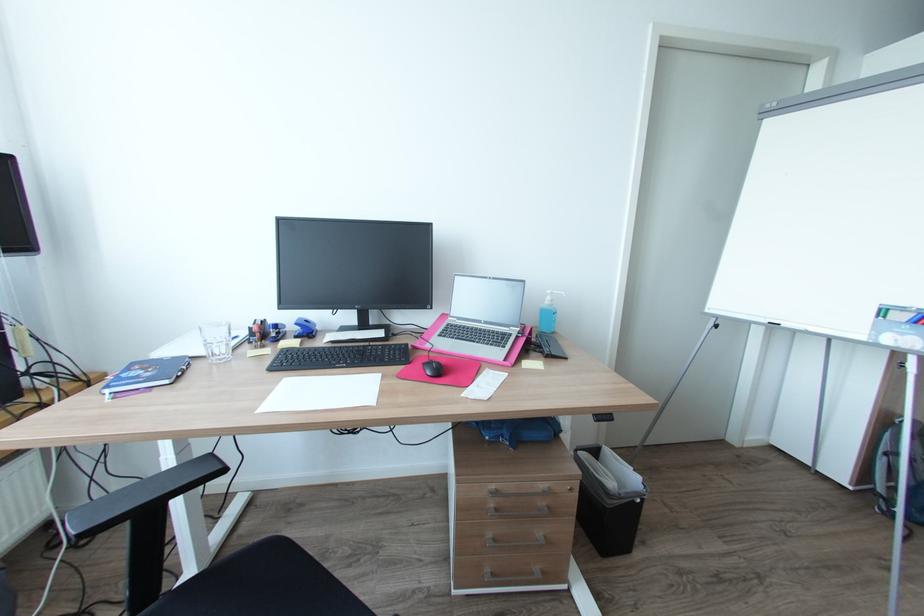
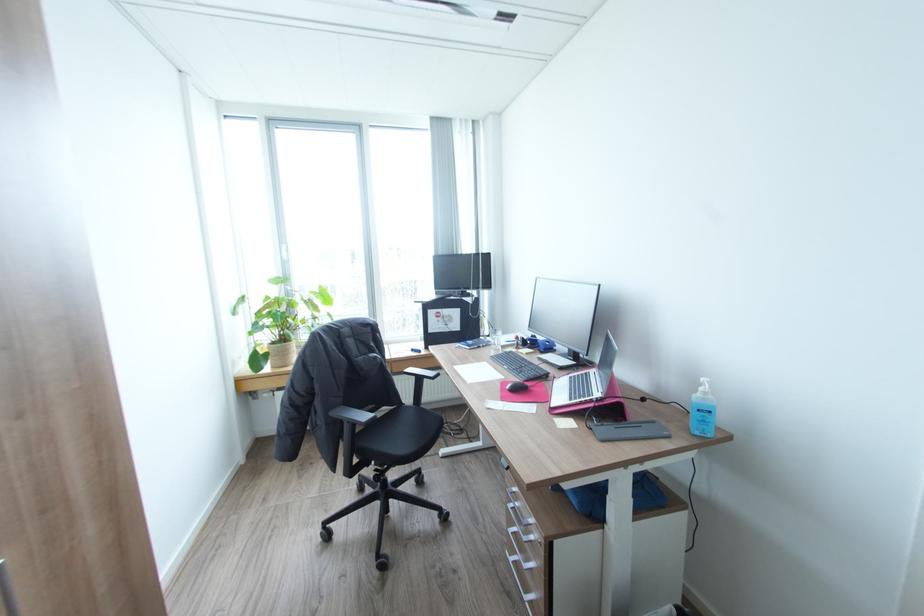
Question: I am providing you with two images of the same scene from different viewpoints. After the viewpoint changes to image2, which objects are now occluded?

Choices:
 (A) water glass
 (B) sanitizer bottle pump
 (C) black chair surface
 (D) none of these

Answer: (D)